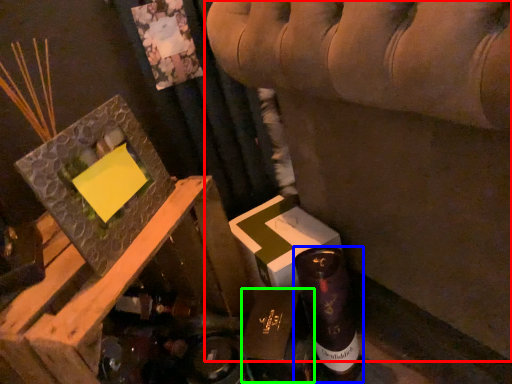
Question: Which object is positioned closest to furniture (highlighted by a red box)? Select from bottle (highlighted by a blue box) and cardboard box (highlighted by a green box).

Choices:
 (A) bottle
 (B) cardboard box

Answer: (A)